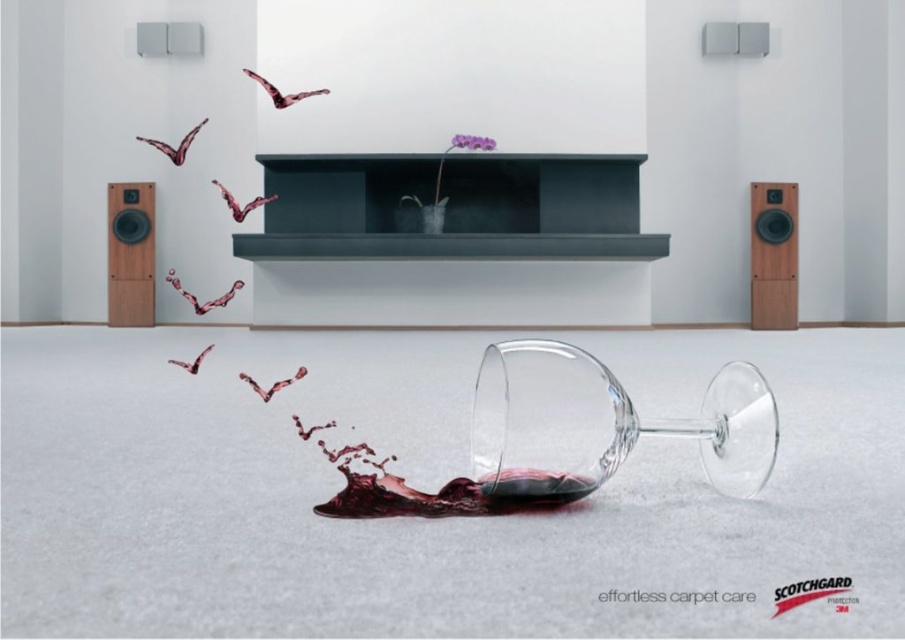
Question: Among these objects, which one is farthest from the camera?

Choices:
 (A) matte black fireplace at center
 (B) wooden/matte speaker at left
 (C) cherry wood speaker at right

Answer: (B)

Question: Which of these objects is positioned closest to the matte black fireplace at center?

Choices:
 (A) cherry wood speaker at right
 (B) wooden/matte speaker at left
 (C) transparent glass at center

Answer: (A)

Question: Which is farther from the dark red liquid at center?

Choices:
 (A) transparent glass at center
 (B) wooden/matte speaker at left

Answer: (B)

Question: Does transparent glass at center have a lesser width compared to cherry wood speaker at right?

Choices:
 (A) no
 (B) yes

Answer: (A)

Question: Is matte black fireplace at center to the right of cherry wood speaker at right from the viewer's perspective?

Choices:
 (A) yes
 (B) no

Answer: (B)

Question: Considering the relative positions of transparent glass at center and cherry wood speaker at right in the image provided, where is transparent glass at center located with respect to cherry wood speaker at right?

Choices:
 (A) left
 (B) right

Answer: (A)